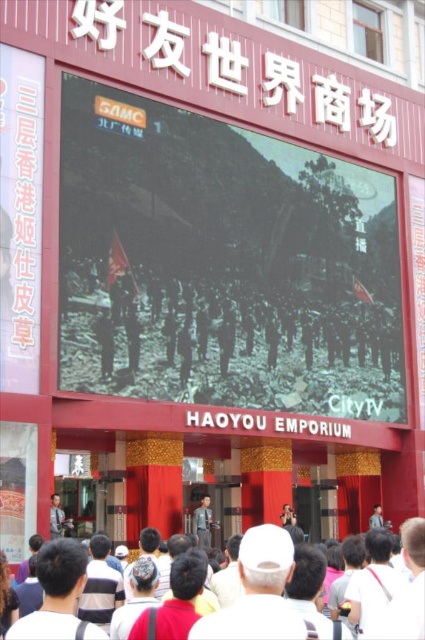
Does point (314, 157) come behind point (410, 544)?

Yes, it is behind point (410, 544).

Which is in front, point (252, 289) or point (394, 620)?

Point (394, 620)

Where is `black matte screen at center`? The width and height of the screenshot is (425, 640). black matte screen at center is located at coordinates (221, 264).

Does black matte screen at center come in front of light brown leather jacket at lower left?

No, it is behind light brown leather jacket at lower left.

Between black matte screen at center and light brown leather jacket at lower left, which one has less height?

Standing shorter between the two is light brown leather jacket at lower left.

At what (x,y) coordinates should I click in order to perform the action: click on black matte screen at center. Please return your answer as a coordinate pair (x, y). The height and width of the screenshot is (640, 425). Looking at the image, I should click on (221, 264).

The image size is (425, 640). Describe the element at coordinates (19, 218) in the screenshot. I see `pink paper sign at left` at that location.

Between pink paper sign at left and khaki uniform at center, which one is positioned higher?

pink paper sign at left

Is point (8, 115) less distant than point (207, 508)?

Yes, point (8, 115) is closer to viewer.

Locate an element on the screen. The image size is (425, 640). pink paper sign at left is located at coordinates (19, 218).